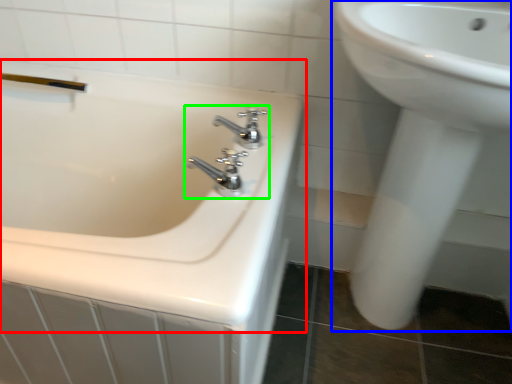
Question: Which object is positioned farthest from bathtub (highlighted by a red box)? Select from sink (highlighted by a blue box) and tap (highlighted by a green box).

Choices:
 (A) sink
 (B) tap

Answer: (A)